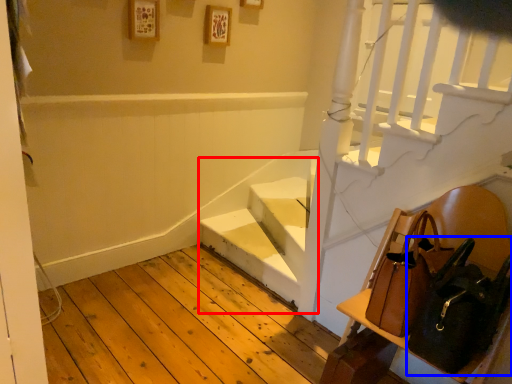
Question: Which object appears closest to the camera in this image, stairwell (highlighted by a red box) or shoulder bag (highlighted by a blue box)?

Choices:
 (A) stairwell
 (B) shoulder bag

Answer: (B)